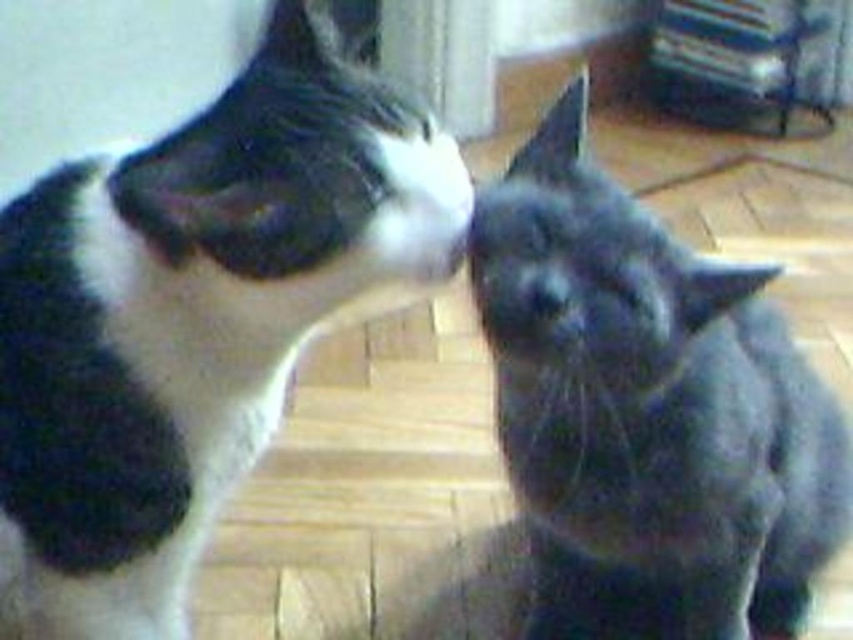
You are a cat owner who wants to place a cat tree between the black and white fur cat at left and the gray fluffy cat at right. Since the cats have different heights, which cat will have an easier time climbing the cat tree?

The gray fluffy cat at right will have an easier time climbing the cat tree because it is taller than the black and white fur cat at left.

You are a photographer trying to capture a closeup of the gray fluffy cat at right and the gray matte nose at center. Based on their positions, which one is closer to the camera?

The gray fluffy cat at right is below the gray matte nose at center, meaning the gray matte nose at center is closer to the camera.

You are a photographer trying to capture a closeup of the gray fluffy cat at right and the soft fur cat at upper left. Which cat is positioned more to the right side of the image?

The gray fluffy cat at right is positioned more to the right side of the image than the soft fur cat at upper left.